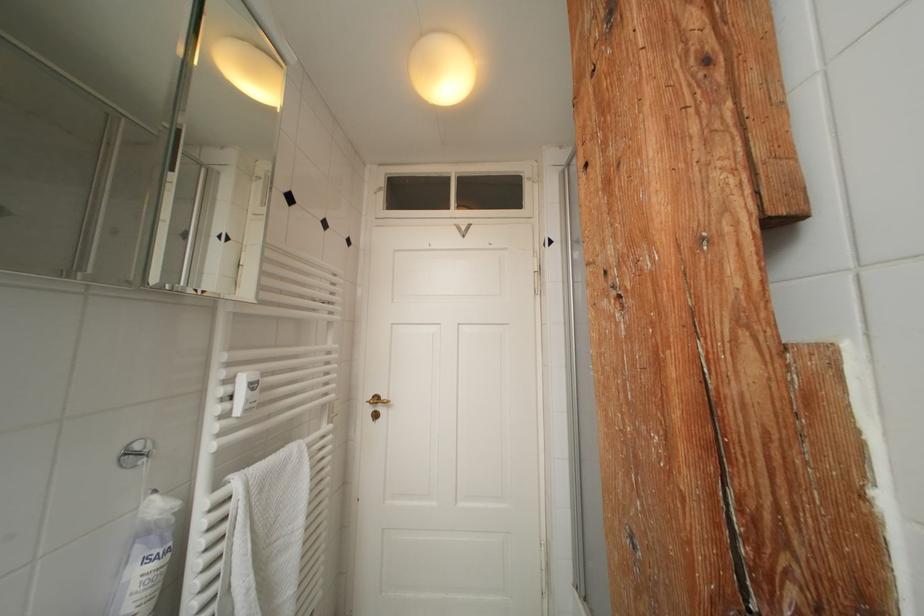
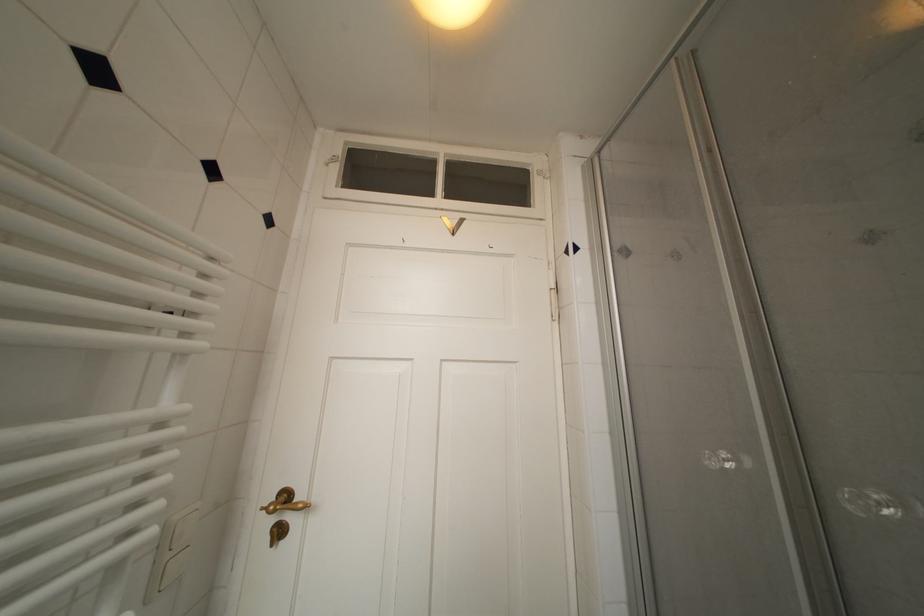
Question: The camera is either moving clockwise (left) or counter-clockwise (right) around the object. The first image is from the beginning of the video and the second image is from the end. Is the camera moving left or right when shooting the video?

Choices:
 (A) Left
 (B) Right

Answer: (A)